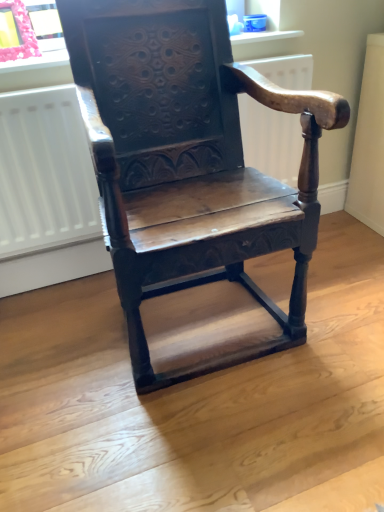
This screenshot has height=512, width=384. I want to click on free space in front of wooden carved chair at center, so click(x=212, y=438).